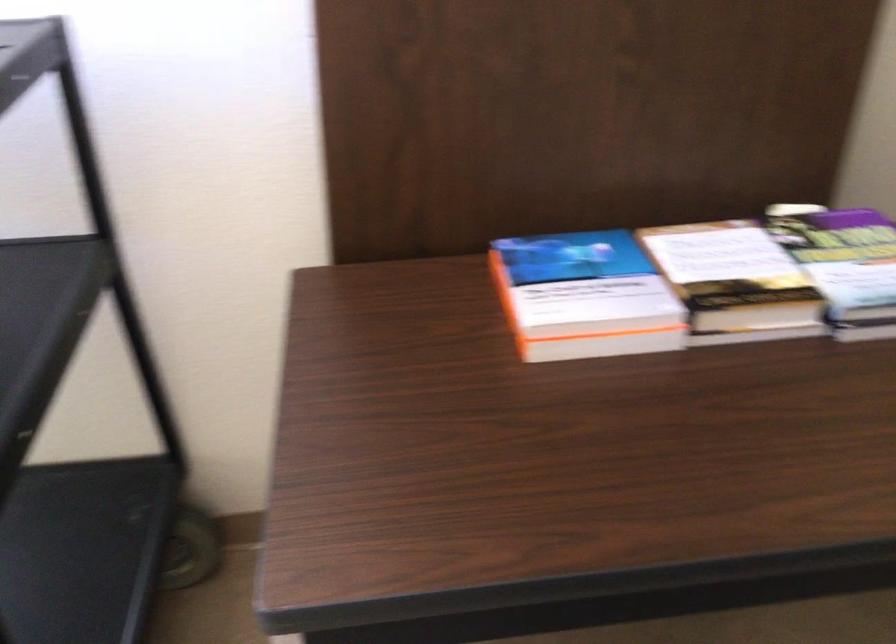
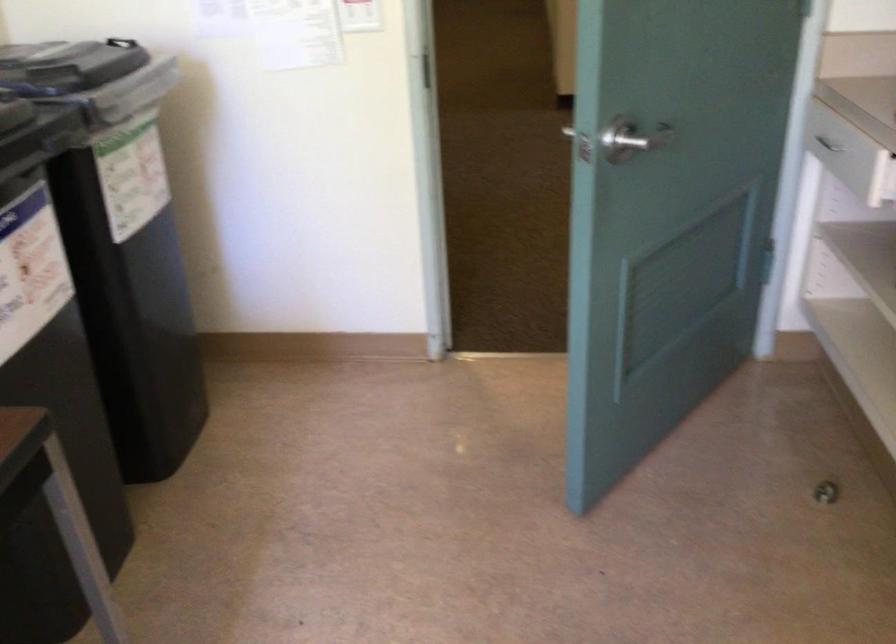
First-person continuous shooting, in which direction is the camera rotating?

The camera rotated toward right-down.